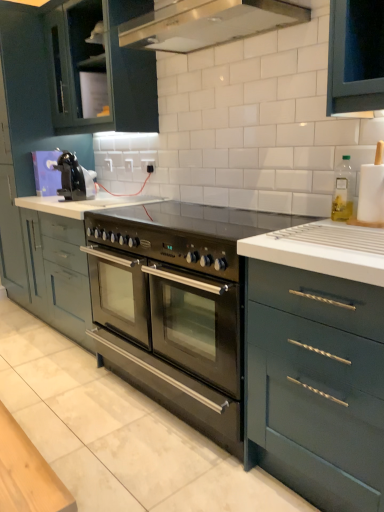
The height and width of the screenshot is (512, 384). I want to click on satin white countertop at center, so click(x=247, y=338).

Describe the element at coordinates (372, 191) in the screenshot. This screenshot has height=512, width=384. I see `white matte paper towel holder at right, which is the 2th appliance from back to front` at that location.

What do you see at coordinates (343, 190) in the screenshot? The height and width of the screenshot is (512, 384). I see `clear glass bottle at upper right, positioned as the second appliance in front-to-back order` at bounding box center [343, 190].

What do you see at coordinates (61, 146) in the screenshot? I see `matte gray cabinets at center, the 2th cabinetry from the top` at bounding box center [61, 146].

You are a GUI agent. You are given a task and a screenshot of the screen. Output one action in this format:
    pyautogui.click(x=<x>, y=<y>)
    Task: Click on the stainless steel gas stove at center
    This screenshot has width=384, height=512.
    Given the screenshot: What is the action you would take?
    pyautogui.click(x=184, y=233)

I want to click on black plastic outlet at center, so click(x=148, y=165).

Can matte black coffee maker at left be found inside matte gray cabinets at center, the 2th cabinetry from the top?

That's incorrect, matte black coffee maker at left is not inside matte gray cabinets at center, the 2th cabinetry from the top.

Is the depth of matte gray cabinets at center, the 2th cabinetry from the bottom, greater than that of matte black coffee maker at left?

Yes, matte gray cabinets at center, the 2th cabinetry from the bottom, is behind matte black coffee maker at left.

Considering the sizes of objects matte gray cabinets at center, the 2th cabinetry from the bottom, and matte black coffee maker at left in the image provided, who is taller, matte gray cabinets at center, the 2th cabinetry from the bottom, or matte black coffee maker at left?

Standing taller between the two is matte gray cabinets at center, the 2th cabinetry from the bottom.

From the image's perspective, relative to matte black coffee maker at left, is matte gray cabinets at center, the 2th cabinetry from the top, above or below?

matte gray cabinets at center, the 2th cabinetry from the top, is above matte black coffee maker at left.

Is stainless steel gas stove at center wider than clear glass bottle at upper right, marked as the first appliance in a back-to-front arrangement?

Indeed, stainless steel gas stove at center has a greater width compared to clear glass bottle at upper right, marked as the first appliance in a back-to-front arrangement.

Is stainless steel gas stove at center inside or outside of clear glass bottle at upper right, marked as the first appliance in a back-to-front arrangement?

stainless steel gas stove at center is not inside clear glass bottle at upper right, marked as the first appliance in a back-to-front arrangement, it's outside.

Could you tell me if stainless steel gas stove at center is facing clear glass bottle at upper right, marked as the first appliance in a back-to-front arrangement?

No, stainless steel gas stove at center is not turned towards clear glass bottle at upper right, marked as the first appliance in a back-to-front arrangement.

Where is `gas stove beneath the clear glass bottle at upper right, marked as the first appliance in a back-to-front arrangement (from a real-world perspective)`? Image resolution: width=384 pixels, height=512 pixels. gas stove beneath the clear glass bottle at upper right, marked as the first appliance in a back-to-front arrangement (from a real-world perspective) is located at coordinates (184, 233).

Are matte black coffee maker at left and matte gray cabinets at center, the 2th cabinetry from the top, making contact?

They are not placed beside each other.

Considering the relative sizes of matte black coffee maker at left and matte gray cabinets at center, the 2th cabinetry from the top, in the image provided, is matte black coffee maker at left bigger than matte gray cabinets at center, the 2th cabinetry from the top,?

Actually, matte black coffee maker at left might be smaller than matte gray cabinets at center, the 2th cabinetry from the top.

Is point (56, 168) in front of point (21, 122)?

Yes, it is in front of point (21, 122).

Is matte black coffee maker at left to the right of matte gray cabinets at center, the 2th cabinetry from the bottom, from the viewer's perspective?

Indeed, matte black coffee maker at left is positioned on the right side of matte gray cabinets at center, the 2th cabinetry from the bottom.

Which of these two, black plastic outlet at center or matte gray cabinets at center, the 2th cabinetry from the bottom, is wider?

matte gray cabinets at center, the 2th cabinetry from the bottom.

From a real-world perspective, is black plastic outlet at center positioned above or below matte gray cabinets at center, the 2th cabinetry from the top?

Clearly, from a real-world perspective, black plastic outlet at center is above matte gray cabinets at center, the 2th cabinetry from the top.

From the image's perspective, starting from the black plastic outlet at center, which cabinetry is the 1st one above? Please provide its 2D coordinates.

[(61, 146)]

Is the position of stainless steel gas stove at center more distant than that of matte dark green cabinet at upper left, the 1th cabinetry viewed from the top?

No, stainless steel gas stove at center is closer to the viewer.

Considering the sizes of objects stainless steel gas stove at center and matte dark green cabinet at upper left, which is the 3th cabinetry from bottom to top, in the image provided, who is taller, stainless steel gas stove at center or matte dark green cabinet at upper left, which is the 3th cabinetry from bottom to top,?

With more height is matte dark green cabinet at upper left, which is the 3th cabinetry from bottom to top.

Considering the relative sizes of stainless steel gas stove at center and matte dark green cabinet at upper left, the 1th cabinetry viewed from the top, in the image provided, is stainless steel gas stove at center wider than matte dark green cabinet at upper left, the 1th cabinetry viewed from the top,?

Yes, stainless steel gas stove at center is wider than matte dark green cabinet at upper left, the 1th cabinetry viewed from the top.

From the image's perspective, which is below, stainless steel gas stove at center or matte dark green cabinet at upper left, which is the 3th cabinetry from bottom to top?

From the image's view, stainless steel gas stove at center is below.

Considering the relative sizes of satin white countertop at center and matte black coffee maker at left in the image provided, is satin white countertop at center smaller than matte black coffee maker at left?

No, satin white countertop at center is not smaller than matte black coffee maker at left.

Identify the location of countertop beneath the matte black coffee maker at left (from a real-world perspective). This screenshot has height=512, width=384. (247, 338).

Is satin white countertop at center to the left of matte black coffee maker at left from the viewer's perspective?

Yes, satin white countertop at center is to the left of matte black coffee maker at left.

What's the angular difference between satin white countertop at center and matte black coffee maker at left's facing directions?

The angular difference between satin white countertop at center and matte black coffee maker at left is 96 degrees.

How distant is stainless steel range hood at upper center from matte gray cabinets at center, the 2th cabinetry from the top?

The distance of stainless steel range hood at upper center from matte gray cabinets at center, the 2th cabinetry from the top, is 78.58 centimeters.

From their relative heights in the image, would you say stainless steel range hood at upper center is taller or shorter than matte gray cabinets at center, the 2th cabinetry from the top?

Considering their sizes, stainless steel range hood at upper center has less height than matte gray cabinets at center, the 2th cabinetry from the top.

Starting from the stainless steel range hood at upper center, which cabinetry is the 3rd one behind? Please provide its 2D coordinates.

[(61, 146)]

Can you confirm if stainless steel range hood at upper center is bigger than matte gray cabinets at center, the 2th cabinetry from the bottom?

No.

Locate an element on the screen. This screenshot has width=384, height=512. kitchen appliance in front of the matte gray cabinets at center, the 2th cabinetry from the top is located at coordinates (74, 178).

Where is `gas stove below the clear glass bottle at upper right, positioned as the second appliance in front-to-back order (from the image's perspective)`? The width and height of the screenshot is (384, 512). gas stove below the clear glass bottle at upper right, positioned as the second appliance in front-to-back order (from the image's perspective) is located at coordinates (184, 233).

Considering their positions, is stainless steel range hood at upper center positioned closer to matte gray cabinets at center, the 2th cabinetry from the bottom, than black plastic outlet at center?

stainless steel range hood at upper center is closer to matte gray cabinets at center, the 2th cabinetry from the bottom.

Estimate the real-world distances between objects in this image. Which object is further from satin white countertop at center, white matte paper towel holder at right, which is the 1th appliance in front-to-back order, or black plastic outlet at center?

black plastic outlet at center is further to satin white countertop at center.

In the scene shown: From the image, which object appears to be farther from stainless steel oven at center, arranged as the 1th cabinetry when ordered from the bottom, satin white countertop at center or black plastic outlet at center?

black plastic outlet at center.

Based on their spatial positions, is matte black coffee maker at left or matte gray cabinets at center, the 2th cabinetry from the top, closer to matte dark green cabinet at upper left, which is the 3th cabinetry from bottom to top?

matte gray cabinets at center, the 2th cabinetry from the top, lies closer to matte dark green cabinet at upper left, which is the 3th cabinetry from bottom to top, than the other object.

Looking at the image, which one is located further to white matte paper towel holder at right, which is the 1th appliance in front-to-back order, black plastic outlet at center or matte dark green cabinet at upper left, which is the 3th cabinetry from bottom to top?

matte dark green cabinet at upper left, which is the 3th cabinetry from bottom to top, is positioned further to the anchor white matte paper towel holder at right, which is the 1th appliance in front-to-back order.

Based on their spatial positions, is white matte paper towel holder at right, which is the 1th appliance in front-to-back order, or stainless steel oven at center, the 3th cabinetry when ordered from top to bottom, further from black plastic outlet at center?

white matte paper towel holder at right, which is the 1th appliance in front-to-back order, lies further to black plastic outlet at center than the other object.

Looking at this image, estimate the real-world distances between objects in this image. Which object is further from matte gray cabinets at center, the 2th cabinetry from the top, stainless steel oven at center, the 3th cabinetry when ordered from top to bottom, or clear glass bottle at upper right, positioned as the second appliance in front-to-back order?

Among the two, clear glass bottle at upper right, positioned as the second appliance in front-to-back order, is located further to matte gray cabinets at center, the 2th cabinetry from the top.

Considering their positions, is matte dark green cabinet at upper left, the 1th cabinetry viewed from the top, positioned further to matte black coffee maker at left than stainless steel oven at center, arranged as the 1th cabinetry when ordered from the bottom?

Based on the image, matte dark green cabinet at upper left, the 1th cabinetry viewed from the top, appears to be further to matte black coffee maker at left.

This screenshot has width=384, height=512. Find the location of `gas stove between stainless steel range hood at upper center and matte black coffee maker at left from front to back`. gas stove between stainless steel range hood at upper center and matte black coffee maker at left from front to back is located at coordinates (184, 233).

Where is `gas stove located between matte gray cabinets at center, the 2th cabinetry from the top, and stainless steel range hood at upper center in the left-right direction`? This screenshot has height=512, width=384. gas stove located between matte gray cabinets at center, the 2th cabinetry from the top, and stainless steel range hood at upper center in the left-right direction is located at coordinates (184, 233).

Where is `home appliance between matte gray cabinets at center, the 2th cabinetry from the bottom, and white matte paper towel holder at right, which is the 1th appliance in front-to-back order, from left to right`? This screenshot has height=512, width=384. home appliance between matte gray cabinets at center, the 2th cabinetry from the bottom, and white matte paper towel holder at right, which is the 1th appliance in front-to-back order, from left to right is located at coordinates (207, 23).

You are a GUI agent. You are given a task and a screenshot of the screen. Output one action in this format:
    pyautogui.click(x=<x>, y=<y>)
    Task: Click on the electric outlet between matte gray cabinets at center, the 2th cabinetry from the bottom, and white matte paper towel holder at right, which is the 2th appliance from back to front, in the horizontal direction
    This screenshot has height=512, width=384.
    Given the screenshot: What is the action you would take?
    pyautogui.click(x=148, y=165)